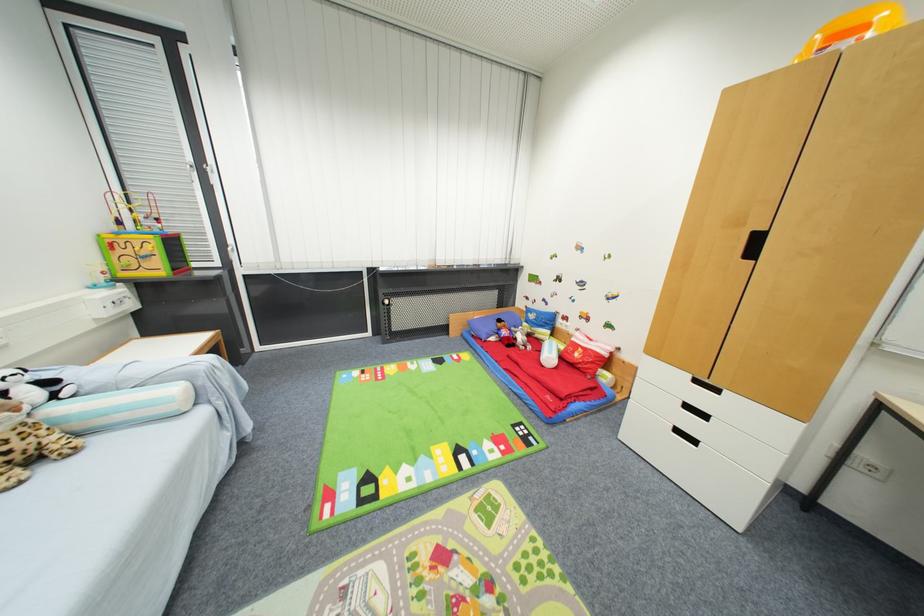
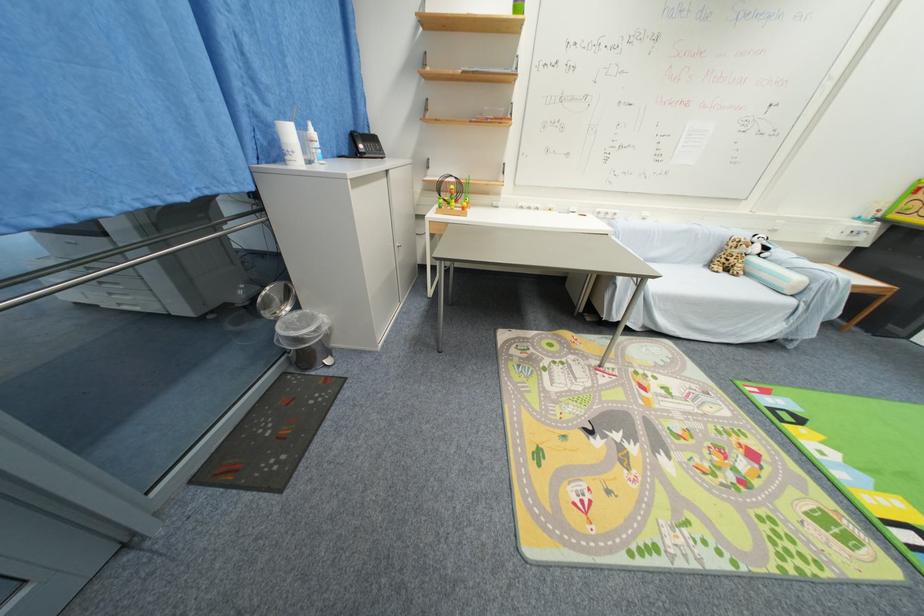
Find the pixel in the second image that matches the point at 54,384 in the first image.

(771, 249)